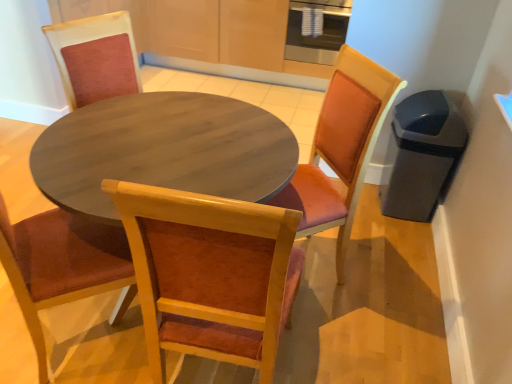
Question: Can you confirm if wooden chair at center, acting as the first chair starting from the front, is shorter than wooden chair with orange cushion at center, positioned as the 2th chair in front-to-back order?

Choices:
 (A) no
 (B) yes

Answer: (A)

Question: Can you confirm if wooden chair at center, arranged as the second chair when viewed from the back, is thinner than wooden chair with orange cushion at center, which appears as the 1th chair when viewed from the back?

Choices:
 (A) no
 (B) yes

Answer: (B)

Question: From the image's perspective, would you say wooden chair at center, acting as the first chair starting from the front, is shown under wooden chair with orange cushion at center, positioned as the 2th chair in front-to-back order?

Choices:
 (A) yes
 (B) no

Answer: (A)

Question: Is wooden chair at center, acting as the first chair starting from the front, far from wooden chair with orange cushion at center, which appears as the 1th chair when viewed from the back?

Choices:
 (A) yes
 (B) no

Answer: (B)

Question: Is the position of wooden chair at center, arranged as the second chair when viewed from the back, less distant than that of wooden chair with orange cushion at center, positioned as the 2th chair in front-to-back order?

Choices:
 (A) no
 (B) yes

Answer: (B)

Question: From the image's perspective, relative to stainless steel oven at upper center, is wooden chair at center, acting as the first chair starting from the front, above or below?

Choices:
 (A) below
 (B) above

Answer: (A)

Question: From their relative heights in the image, would you say wooden chair at center, arranged as the second chair when viewed from the back, is taller or shorter than stainless steel oven at upper center?

Choices:
 (A) tall
 (B) short

Answer: (A)

Question: Looking at the image, does wooden chair at center, arranged as the second chair when viewed from the back, seem bigger or smaller compared to stainless steel oven at upper center?

Choices:
 (A) big
 (B) small

Answer: (A)

Question: Is wooden chair at center, acting as the first chair starting from the front, to the left or to the right of stainless steel oven at upper center in the image?

Choices:
 (A) right
 (B) left

Answer: (B)

Question: Does point (350, 72) appear closer or farther from the camera than point (230, 266)?

Choices:
 (A) farther
 (B) closer

Answer: (A)

Question: Considering the relative positions of wooden chair with orange cushion at center, positioned as the 2th chair in front-to-back order, and wooden chair at center, arranged as the second chair when viewed from the back, in the image provided, is wooden chair with orange cushion at center, positioned as the 2th chair in front-to-back order, to the left or to the right of wooden chair at center, arranged as the second chair when viewed from the back,?

Choices:
 (A) left
 (B) right

Answer: (B)

Question: Looking at the image, does wooden chair with orange cushion at center, positioned as the 2th chair in front-to-back order, seem bigger or smaller compared to wooden chair at center, acting as the first chair starting from the front?

Choices:
 (A) small
 (B) big

Answer: (A)

Question: From a real-world perspective, is wooden chair with orange cushion at center, which appears as the 1th chair when viewed from the back, above or below wooden chair at center, acting as the first chair starting from the front?

Choices:
 (A) below
 (B) above

Answer: (A)

Question: Do you think stainless steel oven at upper center is within wooden chair at center, acting as the first chair starting from the front, or outside of it?

Choices:
 (A) outside
 (B) inside

Answer: (A)

Question: Is point (320, 1) positioned closer to the camera than point (239, 327)?

Choices:
 (A) closer
 (B) farther

Answer: (B)